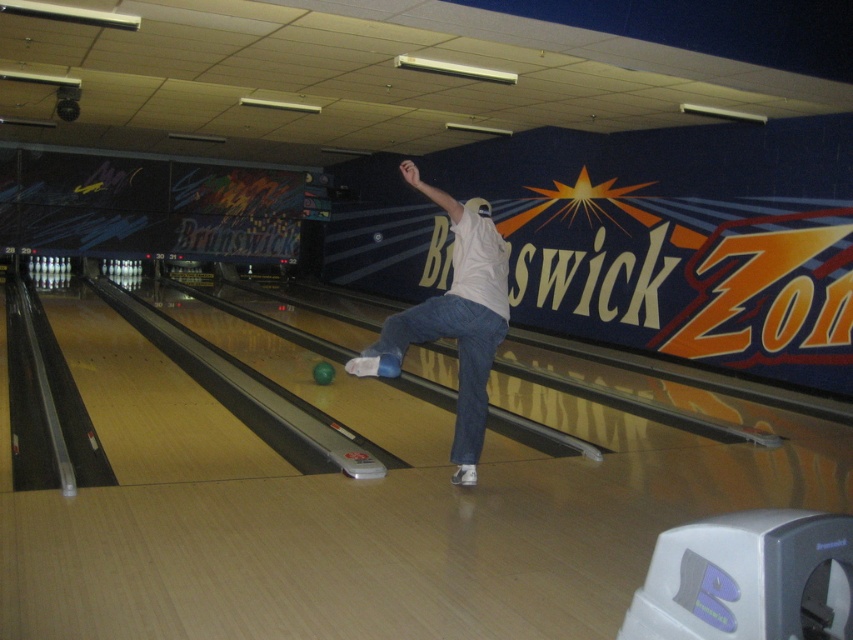
Question: Which of the following is the farthest from the observer?

Choices:
 (A) blue denim jeans at center
 (B) white matte shirt at center

Answer: (A)

Question: Where is white matte shirt at center located in relation to blue denim jeans at center in the image?

Choices:
 (A) right
 (B) left

Answer: (B)

Question: Can you confirm if white matte shirt at center is positioned to the right of blue denim jeans at center?

Choices:
 (A) yes
 (B) no

Answer: (B)

Question: Can you confirm if white matte shirt at center is smaller than blue denim jeans at center?

Choices:
 (A) no
 (B) yes

Answer: (A)

Question: Among these points, which one is farthest from the camera?

Choices:
 (A) (444, 337)
 (B) (392, 316)

Answer: (A)